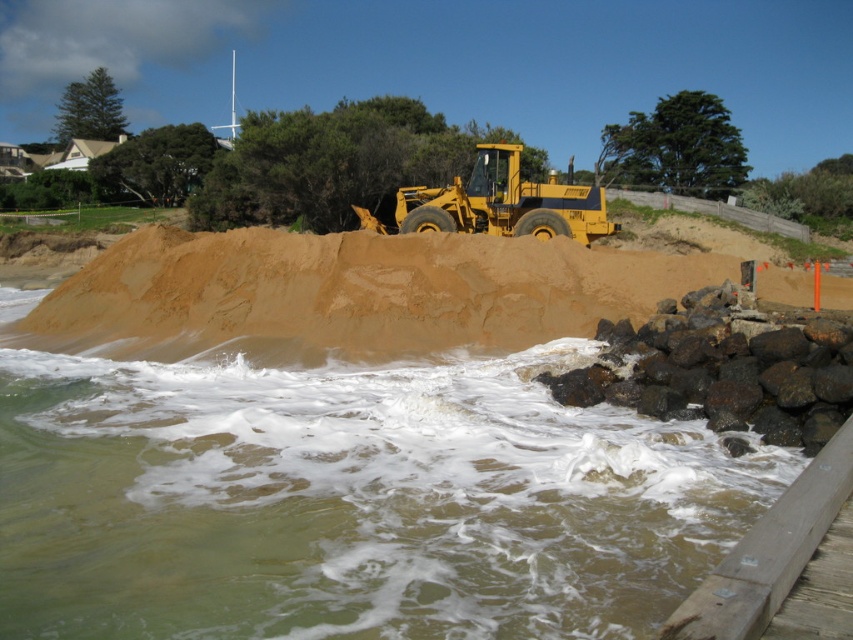
You are a construction worker who needs to cross from the yellow metallic tractor at center to the brown sandy water at lower left. Can you step directly from the tractor to the water without needing to climb over anything?

The brown sandy water at lower left is shorter than the yellow metallic tractor at center, so yes, you can step directly from the yellow metallic tractor at center to the brown sandy water at lower left without needing to climb over anything because the water is lower in height compared to the tractor.

You are standing at point (350, 499) in the coastal construction area. What do you see immediately to your lower left?

At point (350, 499) lies brown sandy water at lower left.

You are standing at the base of the coastal construction site. You need to reach a specific point marked at coordinates point (x=473, y=496). The bulldozer operator informs you that the bulldozer can only move objects within 25 feet. Can the bulldozer safely reach and work at the marked point?

The distance of point (x=473, y=496) from viewer is 24.59 feet, so yes, the bulldozer can safely reach and work at the marked point since it is within the 25 feet range.